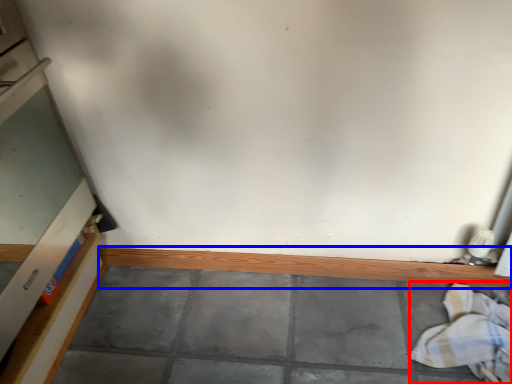
Question: Which of the following is the closest to the observer, laundry (highlighted by a red box) or ledge (highlighted by a blue box)?

Choices:
 (A) laundry
 (B) ledge

Answer: (A)